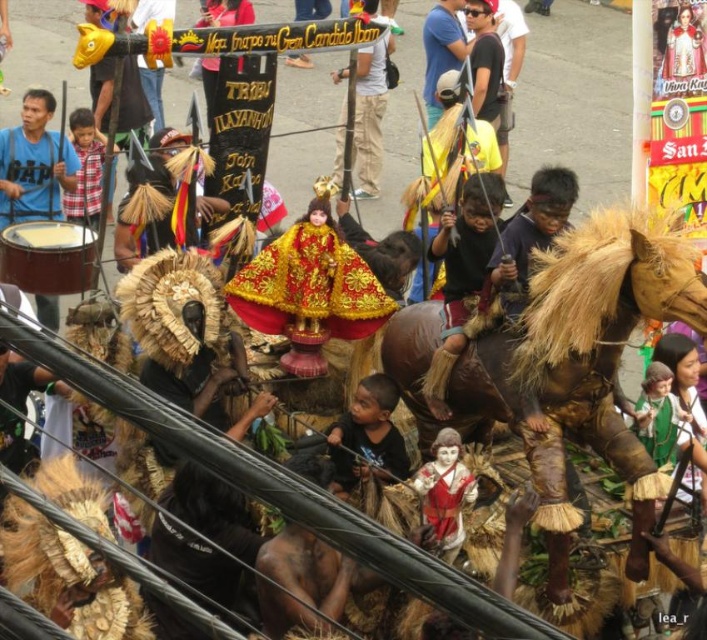
Question: Is smooth brown drum at left closer to the viewer compared to blue cotton shirt at upper center?

Choices:
 (A) yes
 (B) no

Answer: (A)

Question: Is matte gold helmet at center wider than matte gold crown at upper center?

Choices:
 (A) yes
 (B) no

Answer: (A)

Question: Which object is positioned closest to the blue cotton shirt at upper center?

Choices:
 (A) matte gold helmet at center
 (B) smooth brown drum at left

Answer: (A)

Question: Which object is the closest to the matte gold helmet at center?

Choices:
 (A) smooth brown drum at left
 (B) blue cotton shirt at upper center
 (C) matte gold crown at upper center

Answer: (B)

Question: Considering the relative positions of smooth brown drum at left and matte gold helmet at center in the image provided, where is smooth brown drum at left located with respect to matte gold helmet at center?

Choices:
 (A) left
 (B) right

Answer: (A)

Question: Which object is positioned farthest from the matte gold crown at upper center?

Choices:
 (A) blue cotton shirt at upper center
 (B) matte gold helmet at center
 (C) smooth brown drum at left

Answer: (C)